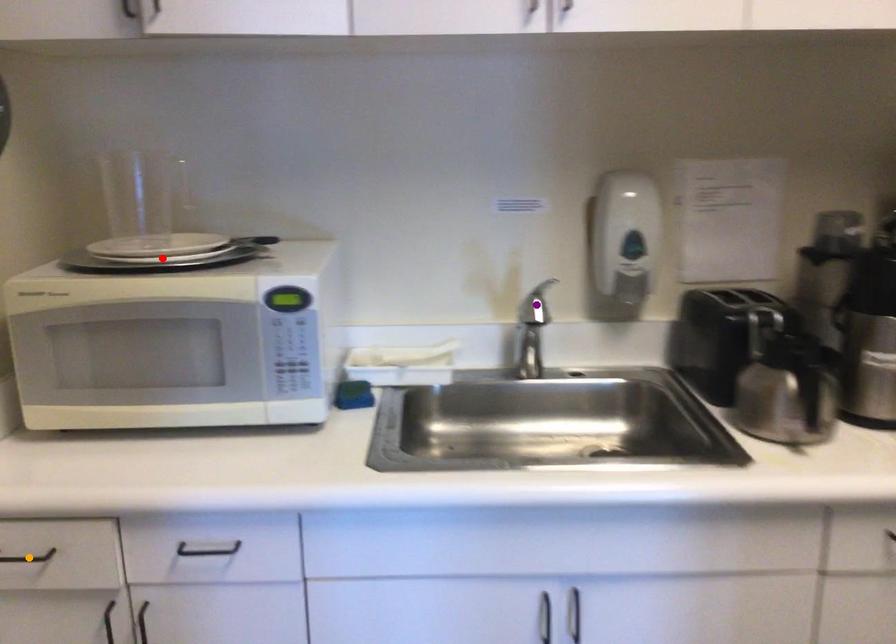
Order these from nearest to farthest:
purple point, red point, orange point

purple point, red point, orange point